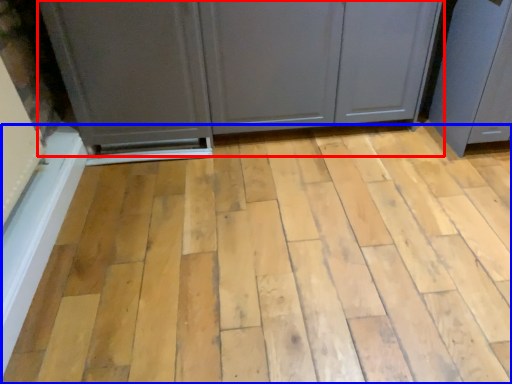
Question: Which object appears farthest to the camera in this image, cupboard (highlighted by a red box) or plank (highlighted by a blue box)?

Choices:
 (A) cupboard
 (B) plank

Answer: (A)